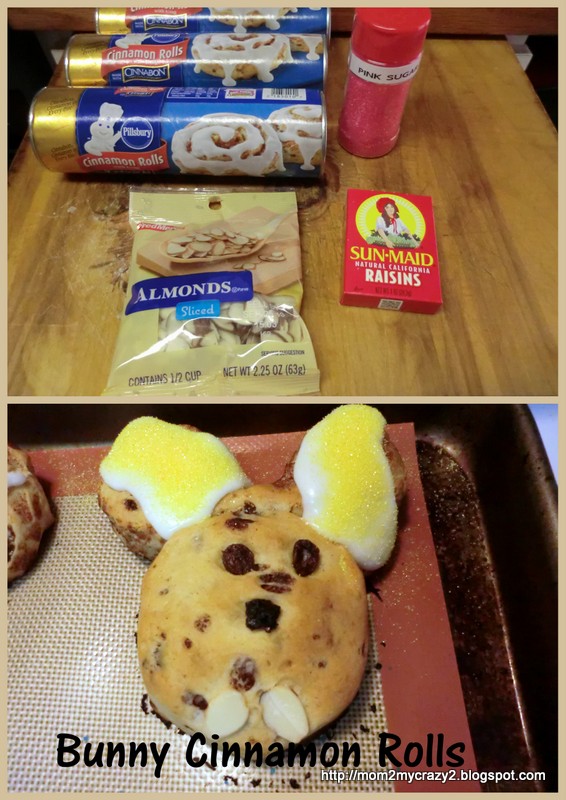
Where is `wood  counter top`? The width and height of the screenshot is (566, 800). wood  counter top is located at coordinates (510, 210).